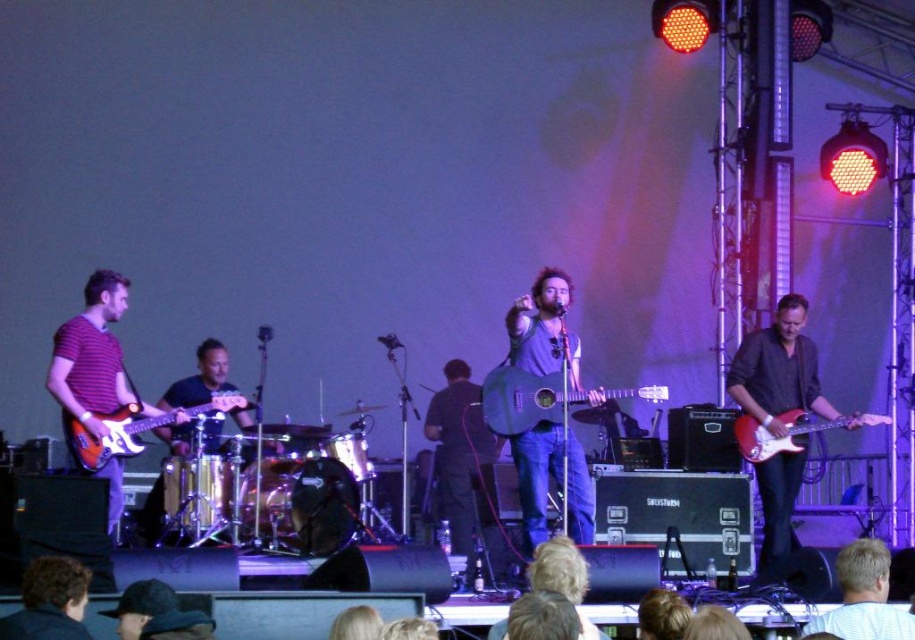
Question: Can you confirm if striped fabric guitar at left is thinner than acoustic wood guitar at center?

Choices:
 (A) no
 (B) yes

Answer: (B)

Question: Which is farther from the striped fabric guitar at left?

Choices:
 (A) blonde hair at lower right
 (B) matte electric guitar at left

Answer: (A)

Question: Which point is farther to the camera?

Choices:
 (A) striped fabric guitar at left
 (B) matte red electric guitar at right

Answer: (B)

Question: Which object is closer to the camera taking this photo?

Choices:
 (A) acoustic wood guitar at center
 (B) glossy red electric guitar at right
 (C) matte red electric guitar at right

Answer: (A)

Question: Does striped fabric guitar at left have a greater width compared to glossy red electric guitar at right?

Choices:
 (A) yes
 (B) no

Answer: (B)

Question: Can you confirm if matte acoustic guitar at center is positioned to the left of glossy red electric guitar at right?

Choices:
 (A) no
 (B) yes

Answer: (B)